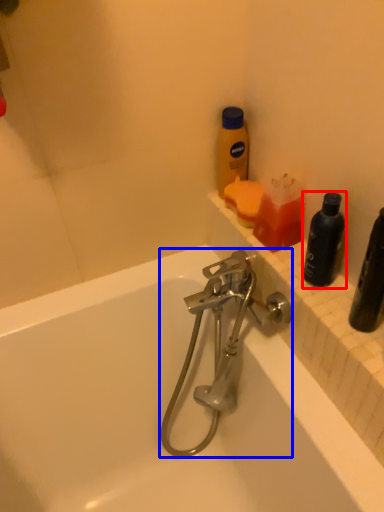
Question: Among these objects, which one is farthest to the camera, bottle (highlighted by a red box) or tap (highlighted by a blue box)?

Choices:
 (A) bottle
 (B) tap

Answer: (B)